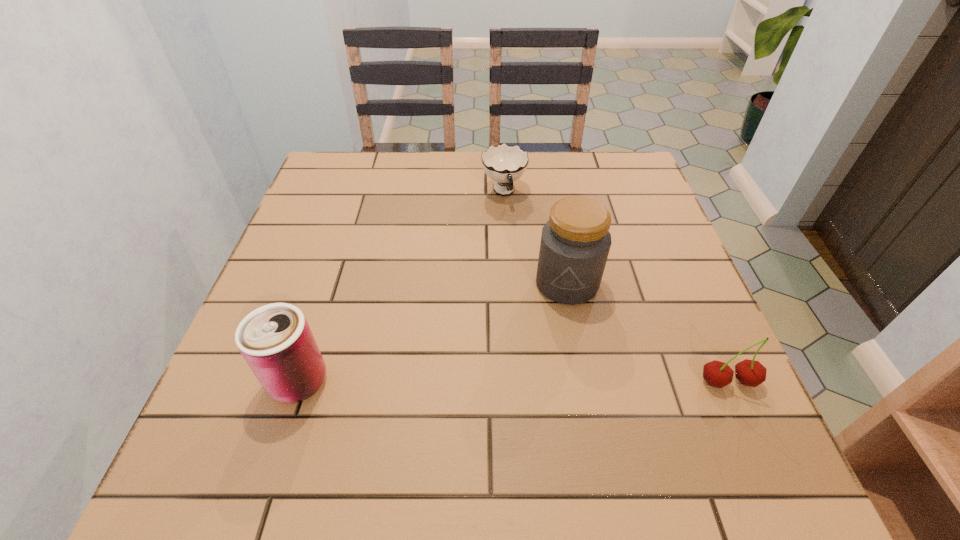
In order to click on free space that satisfies the following two spatial constraints: 1. on the front side of the tallest object; 2. on the right side of the shortest object in this screenshot , I will do `click(510, 284)`.